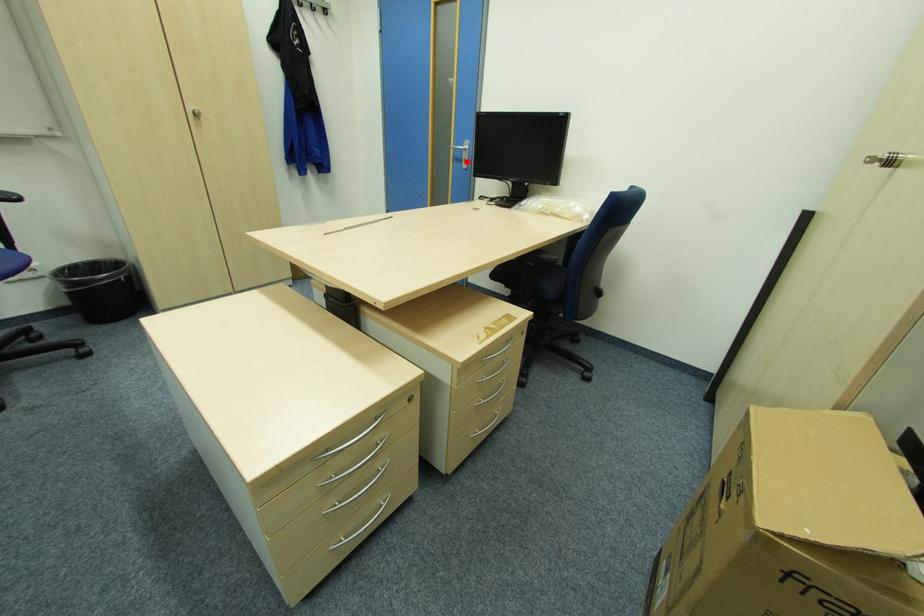
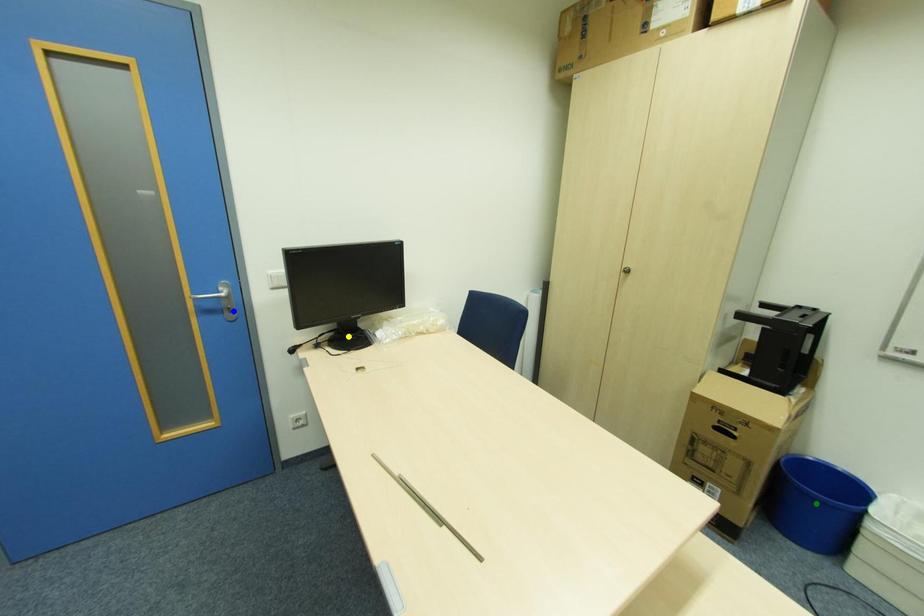
Question: I am providing you with two images of the same scene from different viewpoints. A red point is marked on the first image. You are given multiple points on the second image. Which point in image 2 is actually the same real-world point as the red point in image 1?

Choices:
 (A) blue point
 (B) yellow point
 (C) green point

Answer: (A)